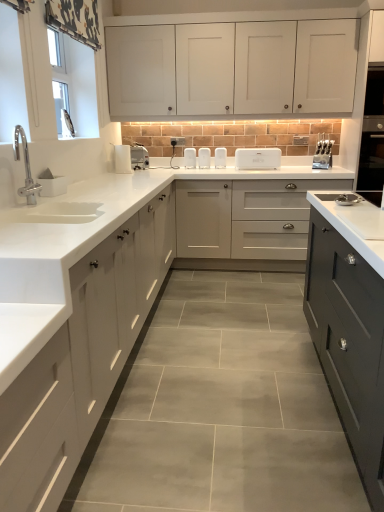
Question: Which direction should I rotate to face silver metallic toaster at center, acting as the 4th appliance starting from the front, — up or down?

Choices:
 (A) up
 (B) down

Answer: (A)

Question: Does white plastic toaster at center, the 2th appliance in the right-to-left sequence, have a greater height compared to white matte cabinet at upper center, which is the 1th cabinetry in top-to-bottom order?

Choices:
 (A) yes
 (B) no

Answer: (B)

Question: From the image's perspective, is white plastic toaster at center, the 2th appliance in the right-to-left sequence, beneath white matte cabinet at upper center, which is the third cabinetry in bottom-to-top order?

Choices:
 (A) no
 (B) yes

Answer: (B)

Question: From the image's perspective, would you say white plastic toaster at center, the 2th appliance in the right-to-left sequence, is positioned over white matte cabinet at upper center, which is the third cabinetry in bottom-to-top order?

Choices:
 (A) no
 (B) yes

Answer: (A)

Question: Can you confirm if white plastic toaster at center, which ranks as the 5th appliance in front-to-back order, is thinner than white matte cabinet at upper center, which is the third cabinetry in bottom-to-top order?

Choices:
 (A) yes
 (B) no

Answer: (A)

Question: Is white plastic toaster at center, which ranks as the 5th appliance in front-to-back order, in contact with white matte cabinet at upper center, which is the 1th cabinetry in top-to-bottom order?

Choices:
 (A) yes
 (B) no

Answer: (B)

Question: Is white plastic toaster at center, the 2th appliance in the right-to-left sequence, outside white matte cabinet at upper center, which is the 1th cabinetry in top-to-bottom order?

Choices:
 (A) no
 (B) yes

Answer: (B)

Question: From the image's perspective, is white glossy countertop at center located beneath satin silver knife block at right, positioned as the third appliance in front-to-back order?

Choices:
 (A) yes
 (B) no

Answer: (A)

Question: Considering the relative sizes of white glossy countertop at center and satin silver knife block at right, the 8th appliance in the left-to-right sequence, in the image provided, is white glossy countertop at center wider than satin silver knife block at right, the 8th appliance in the left-to-right sequence,?

Choices:
 (A) no
 (B) yes

Answer: (B)

Question: Is white glossy countertop at center not inside satin silver knife block at right, positioned as the third appliance in front-to-back order?

Choices:
 (A) no
 (B) yes

Answer: (B)

Question: Is white glossy countertop at center smaller than satin silver knife block at right, placed as the 6th appliance when sorted from back to front?

Choices:
 (A) yes
 (B) no

Answer: (B)

Question: Is white glossy countertop at center surrounding satin silver knife block at right, the 8th appliance in the left-to-right sequence?

Choices:
 (A) yes
 (B) no

Answer: (B)

Question: Is white glossy countertop at center far away from satin silver knife block at right, positioned as the third appliance in front-to-back order?

Choices:
 (A) no
 (B) yes

Answer: (B)

Question: Is white matte soap dish at left, the first appliance positioned from the left, turned away from satin silver knife block at right, marked as the 1th appliance in a right-to-left arrangement?

Choices:
 (A) no
 (B) yes

Answer: (A)